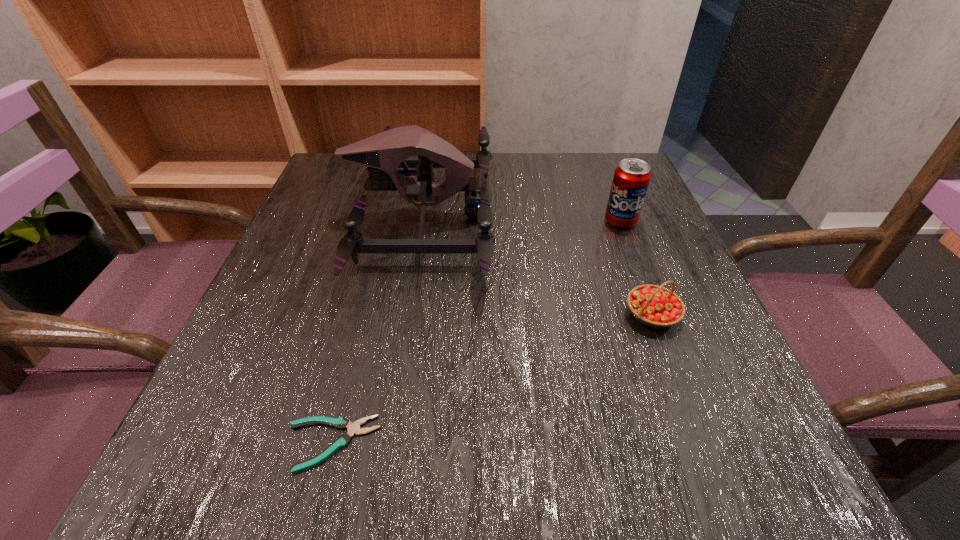
This screenshot has width=960, height=540. I want to click on drone, so click(383, 153).

Locate an element on the screen. the second tallest object is located at coordinates (631, 178).

The width and height of the screenshot is (960, 540). I want to click on strawberry, so click(x=655, y=306).

I want to click on the nearest object, so click(x=342, y=441).

Locate an element on the screen. The width and height of the screenshot is (960, 540). the shortest object is located at coordinates [x=342, y=441].

This screenshot has width=960, height=540. Identify the location of vacant space positioned 0.270m on the front-facing side of the drone. (617, 218).

Where is `vacant area situated 0.200m on the left of the third shortest object`? This screenshot has height=540, width=960. vacant area situated 0.200m on the left of the third shortest object is located at coordinates (512, 221).

Locate an element on the screen. The image size is (960, 540). free location located on the back of the strawberry is located at coordinates (603, 187).

You are a GUI agent. You are given a task and a screenshot of the screen. Output one action in this format:
    pyautogui.click(x=<x>, y=<y>)
    Task: Click on the vacant area located on the back of the nearest object
    
    Given the screenshot: What is the action you would take?
    (x=372, y=282)

You are a GUI agent. You are given a task and a screenshot of the screen. Output one action in this format:
    pyautogui.click(x=<x>, y=<y>)
    Task: Click on the object present at the far edge
    Image resolution: width=960 pixels, height=540 pixels.
    Given the screenshot: What is the action you would take?
    pyautogui.click(x=383, y=153)